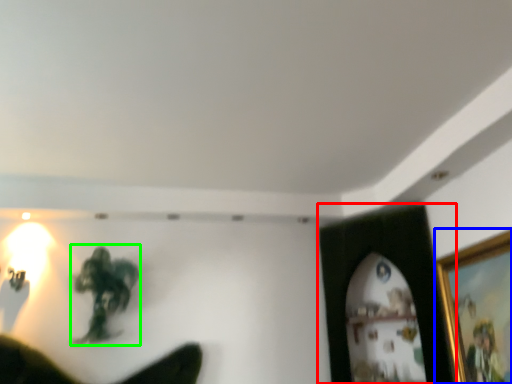
Question: Estimate the real-world distances between objects in this image. Which object is farther from picture frame (highlighted by a red box), picture frame (highlighted by a blue box) or person (highlighted by a green box)?

Choices:
 (A) picture frame
 (B) person

Answer: (B)